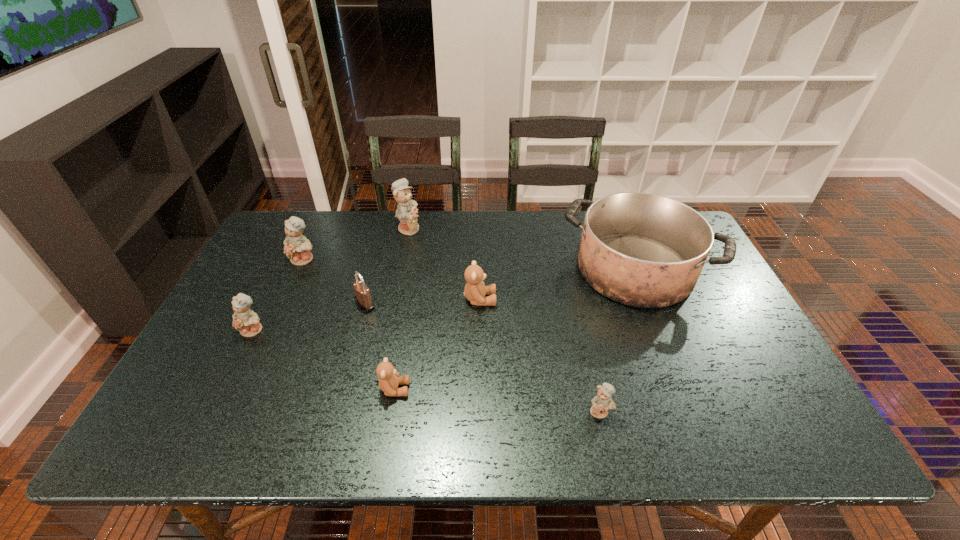
Identify the location of the second blue teddy bear from right to left. (406, 212).

You are a GUI agent. You are given a task and a screenshot of the screen. Output one action in this format:
    pyautogui.click(x=<x>, y=<y>)
    Task: Click on the tallest teddy bear
    
    Given the screenshot: What is the action you would take?
    pyautogui.click(x=406, y=212)

You are a GUI agent. You are given a task and a screenshot of the screen. Output one action in this format:
    pyautogui.click(x=<x>, y=<y>)
    Task: Click on the saucepan
    The image size is (960, 540).
    Given the screenshot: What is the action you would take?
    pyautogui.click(x=644, y=250)

Identify the location of the third nearest blue teddy bear. This screenshot has width=960, height=540. (297, 247).

Locate an element on the screen. the fifth shortest teddy bear is located at coordinates (297, 247).

This screenshot has height=540, width=960. What are the coordinates of `the farther brown teddy bear` in the screenshot? It's located at (475, 290).

You are a GUI agent. You are given a task and a screenshot of the screen. Output one action in this format:
    pyautogui.click(x=<x>, y=<y>)
    Task: Click on the right brown teddy bear
    The image size is (960, 540).
    Given the screenshot: What is the action you would take?
    pyautogui.click(x=475, y=290)

Find the location of `the third farthest blue teddy bear`. the third farthest blue teddy bear is located at coordinates (245, 320).

Locate an element on the screen. This screenshot has height=540, width=960. the second smallest blue teddy bear is located at coordinates (245, 320).

What are the coordinates of `the sixth object from right to left` in the screenshot? It's located at (363, 297).